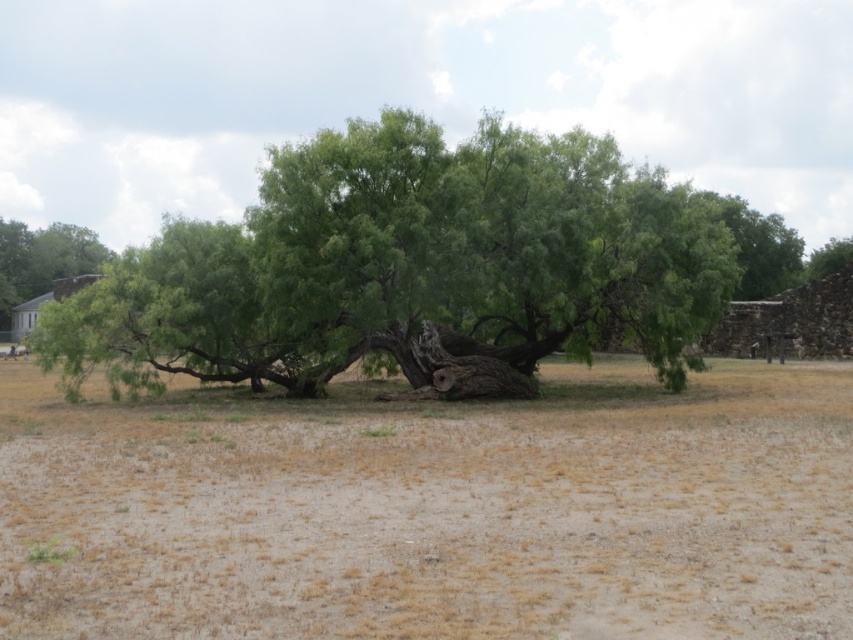
You are standing in the open, dry landscape and want to walk from the brown brick chimney at left to the brown dry grass at center. Which direction should you move relative to the chimney?

To move from the brown brick chimney at left to the brown dry grass at center, you should move to the right since the brown dry grass at center is positioned on the right side of the brown brick chimney at left.

You are a painter setting up your easel to capture the landscape. You want to ensure the green leafy tree at left and brown brick chimney at left are both visible in your painting. Given their sizes, which object should you place closer to the center to emphasize its prominence?

The green leafy tree at left should be placed closer to the center since it has a larger size compared to the brown brick chimney at left, making it more prominent in the painting.

You are standing in the open, dry landscape and want to walk towards the brown brick chimney at left. Which direction should you move relative to the brown dry grass at center?

Since the brown dry grass at center is closer to the viewer than the brown brick chimney at left, you should move away from the brown dry grass at center to reach the brown brick chimney at left.